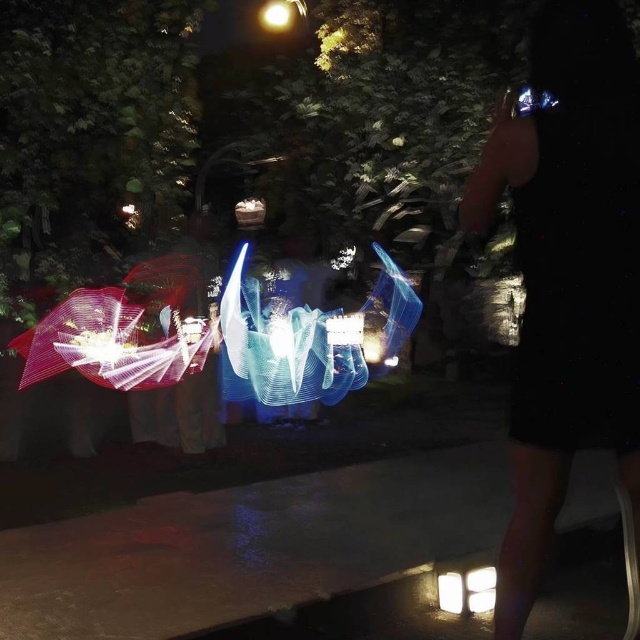
You are standing at the center of the image and want to move towards the white glossy light at lower center. Which direction should you move in?

The white glossy light at lower center is located at point (451,593), so you should move towards the lower center direction to reach it.

Based on the photo, you are standing on the paved ground in the nighttime scene. You see a white glossy light at lower center and a white glossy square at lower right. Which object is closer to the ground?

The white glossy light at lower center is positioned under the white glossy square at lower right, so it is closer to the ground.